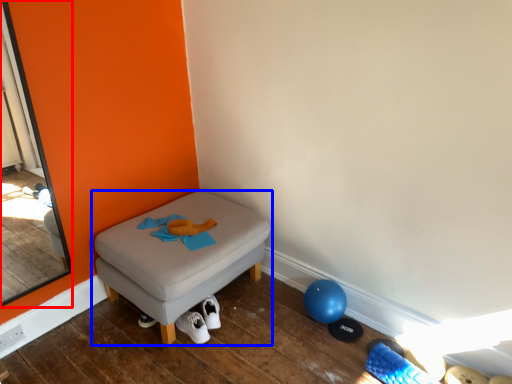
Question: Which object is further to the camera taking this photo, screen door (highlighted by a red box) or furniture (highlighted by a blue box)?

Choices:
 (A) screen door
 (B) furniture

Answer: (B)